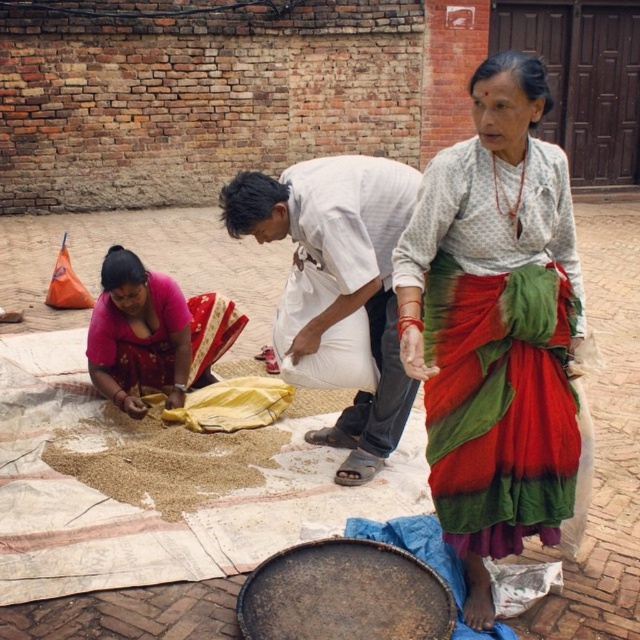
Based on the photo, is multicolored fabric at center wider than matte pink blouse at lower left?

In fact, multicolored fabric at center might be narrower than matte pink blouse at lower left.

The width and height of the screenshot is (640, 640). In order to click on multicolored fabric at center in this screenshot , I will do click(496, 326).

Identify the location of multicolored fabric at center. (496, 326).